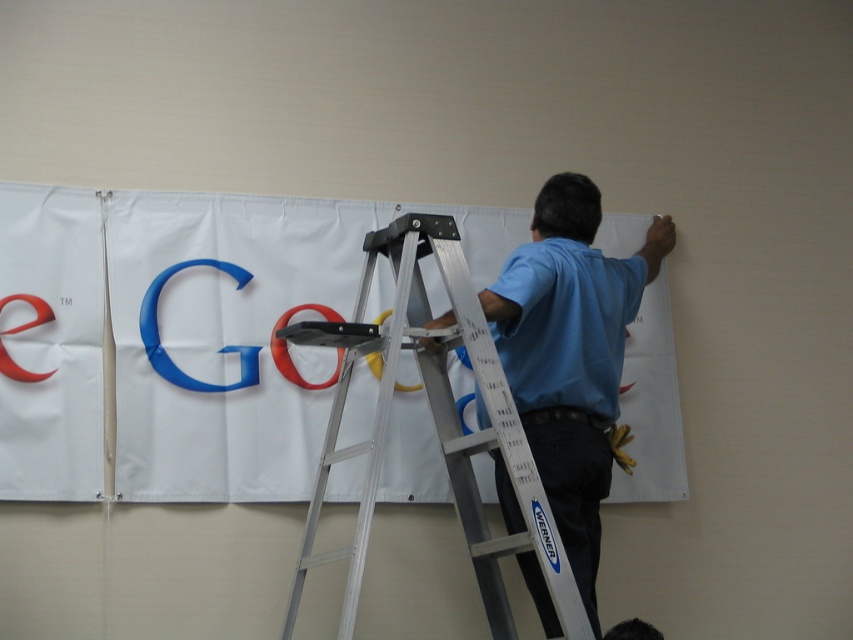
Based on the photo, is white fabric banner at upper center taller than blue shirt at upper center?

Incorrect, white fabric banner at upper center's height is not larger of blue shirt at upper center's.

Which is more to the left, white fabric banner at upper center or blue shirt at upper center?

Positioned to the left is white fabric banner at upper center.

The width and height of the screenshot is (853, 640). Find the location of `white fabric banner at upper center`. white fabric banner at upper center is located at coordinates (183, 336).

Locate an element on the screen. Image resolution: width=853 pixels, height=640 pixels. white fabric banner at upper center is located at coordinates (183, 336).

Is blue shirt at upper center bigger than silver/aluminum step ladder at center?

Indeed, blue shirt at upper center has a larger size compared to silver/aluminum step ladder at center.

Based on the photo, who is more distant from viewer, (x=612, y=332) or (x=387, y=340)?

Positioned behind is point (x=612, y=332).

Does point (585, 424) lie behind point (526, 470)?

Yes.

Locate an element on the screen. The width and height of the screenshot is (853, 640). blue shirt at upper center is located at coordinates (570, 355).

Does white fabric banner at upper center have a greater height compared to silver/aluminum step ladder at center?

No, white fabric banner at upper center is not taller than silver/aluminum step ladder at center.

Does white fabric banner at upper center have a lesser width compared to silver/aluminum step ladder at center?

In fact, white fabric banner at upper center might be wider than silver/aluminum step ladder at center.

Which is in front, point (463, 364) or point (495, 436)?

Point (495, 436)

The image size is (853, 640). I want to click on white fabric banner at upper center, so click(x=183, y=336).